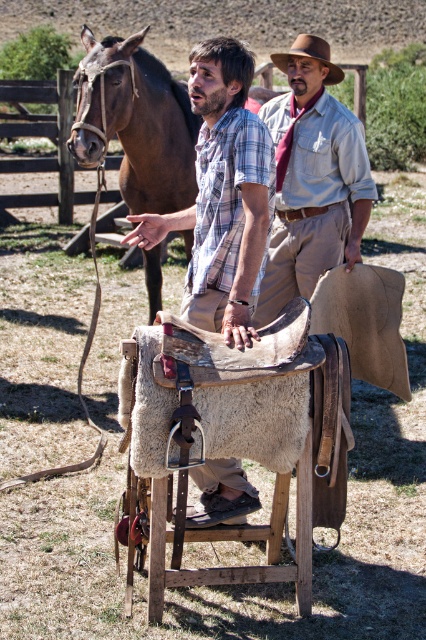
Where is the brown leather saddle at center located in the image?

The brown leather saddle at center is located at point (x=226, y=452) in the image.

You are a photographer trying to capture a clear shot of both the brown leather saddle at center and the brown felt cowboy hat at upper center. Since you want both items to be in focus, which one should you adjust your camera focus on first?

The brown leather saddle at center is closer to the viewer than the brown felt cowboy hat at upper center, so you should focus on the brown leather saddle at center first to ensure both are in focus.